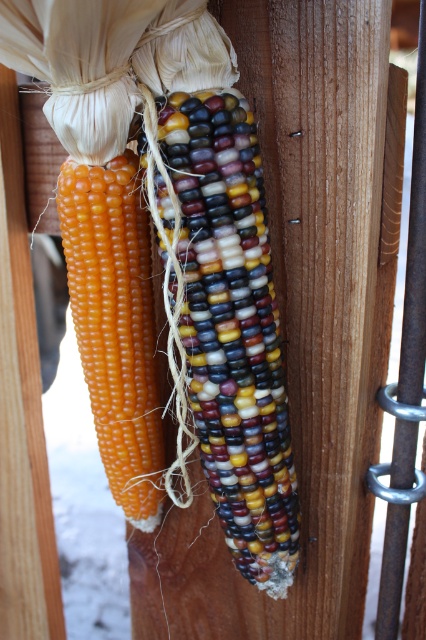
Can you confirm if multicolored polished corn at center is smaller than smooth yellow corn at left?

Actually, multicolored polished corn at center might be larger than smooth yellow corn at left.

Between multicolored polished corn at center and smooth yellow corn at left, which one has more height?

multicolored polished corn at center

Where is `multicolored polished corn at center`? multicolored polished corn at center is located at coordinates (230, 326).